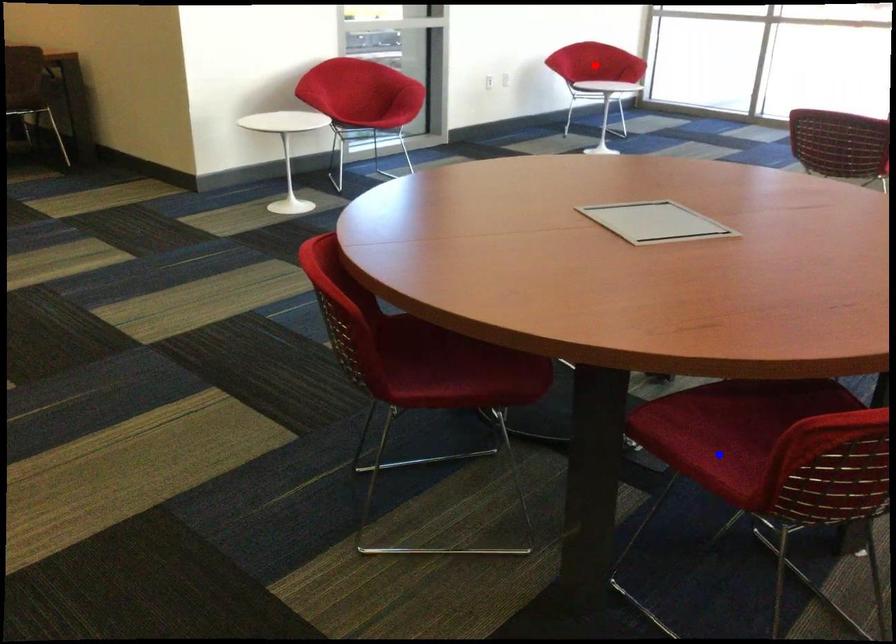
Question: In the image, two points are highlighted. Which point is nearer to the camera? Reply with the corresponding letter.

Choices:
 (A) blue point
 (B) red point

Answer: (A)